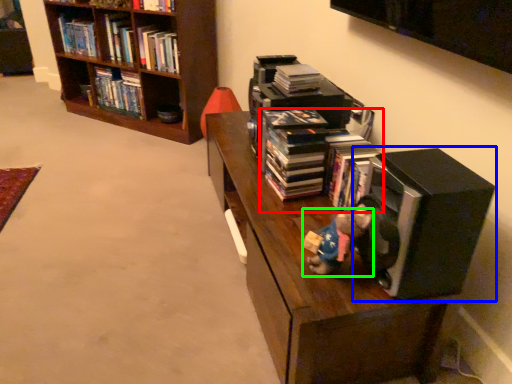
Question: Which is nearer to the book (highlighted by a red box)? speaker (highlighted by a blue box) or figurine (highlighted by a green box).

Choices:
 (A) speaker
 (B) figurine

Answer: (A)